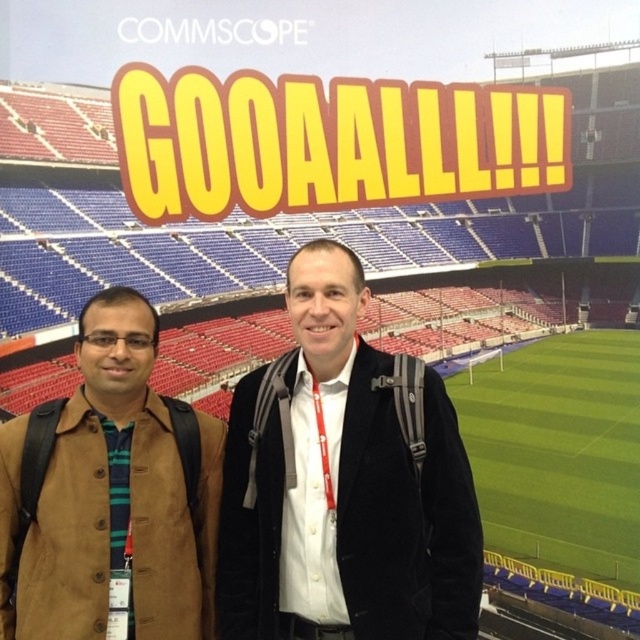
You are organizing a charity event and need to decide which jacket to display. The black velvet jacket at center and the brown suede jacket at left are both options. Which jacket has a larger size?

The black velvet jacket at center is bigger than the brown suede jacket at left, so it has a larger size.